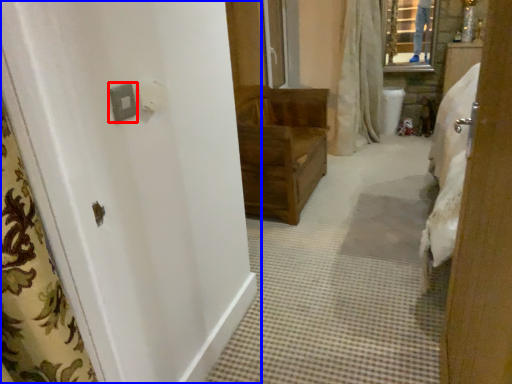
Question: Which point is closer to the camera, light switch (highlighted by a red box) or door (highlighted by a blue box)?

Choices:
 (A) light switch
 (B) door

Answer: (B)